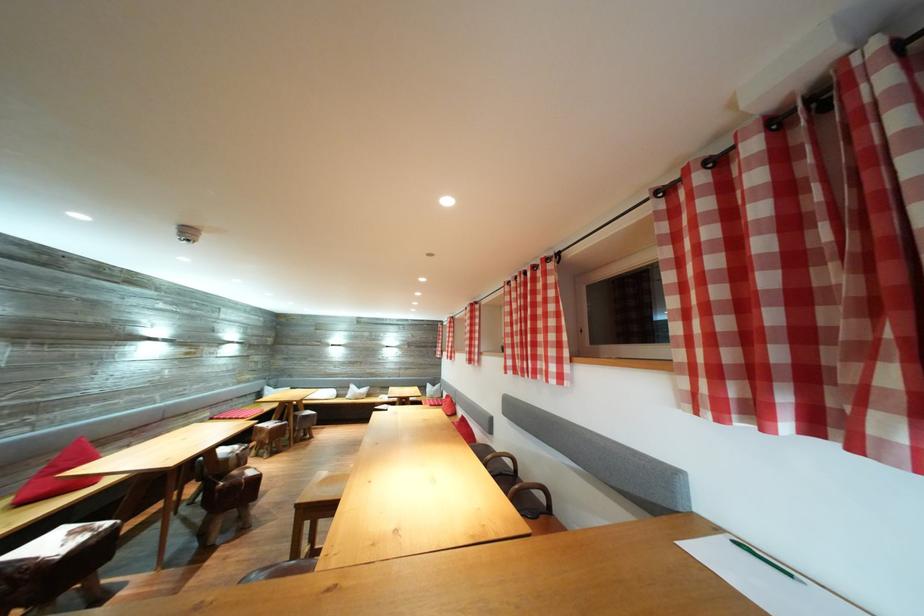
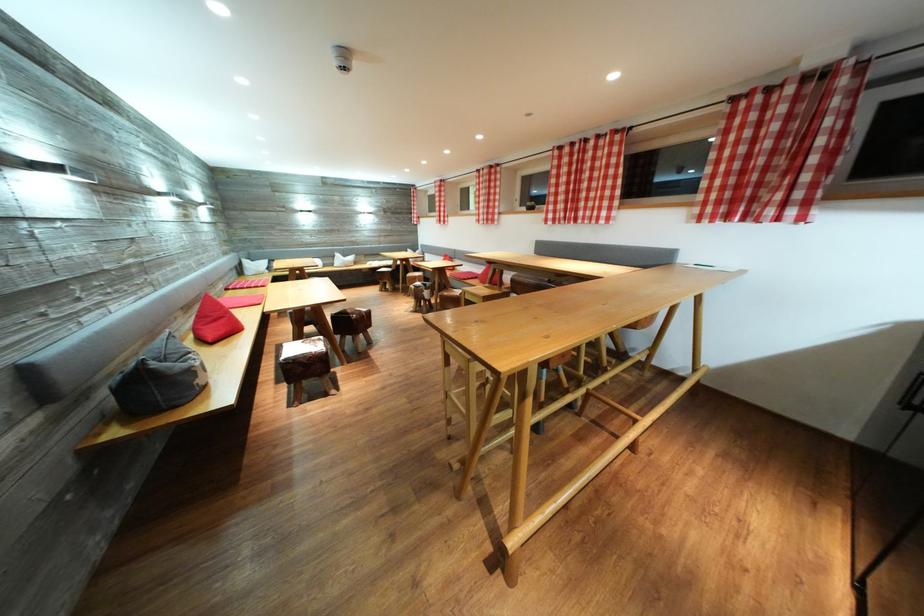
Question: I am providing you with two images of the same scene from different viewpoints. Which of the following objects are not visible in image2?

Choices:
 (A) chair sitting surface
 (B) gray beanbag cushion
 (C) cowhide stool
 (D) none of these

Answer: (D)